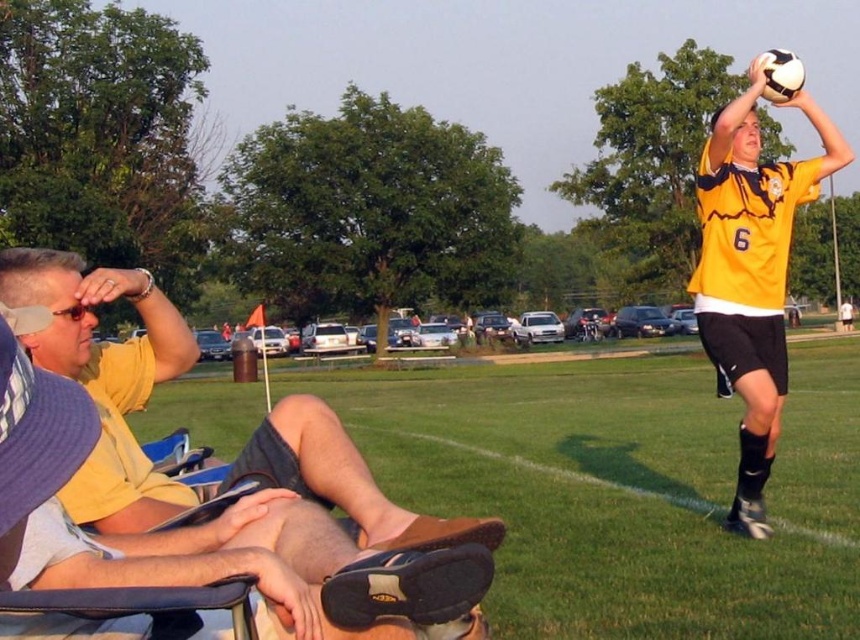
Question: Is yellow cotton shirt at left in front of yellow jersey at upper right?

Choices:
 (A) no
 (B) yes

Answer: (B)

Question: Observing the image, what is the correct spatial positioning of matte yellow sunglasses at upper left in reference to yellow jersey at upper right?

Choices:
 (A) above
 (B) below

Answer: (B)

Question: Among these points, which one is farthest from the camera?

Choices:
 (A) (13, 468)
 (B) (17, 285)

Answer: (B)

Question: Which is nearer to the dark blue fabric folding chair at lower left?

Choices:
 (A) yellow jersey at upper right
 (B) yellow cotton shirt at left
 (C) matte yellow sunglasses at upper left

Answer: (B)

Question: Which point is farther from the camera taking this photo?

Choices:
 (A) (717, 166)
 (B) (71, 353)
 (C) (11, 259)

Answer: (A)

Question: Does dark blue fabric folding chair at lower left appear under yellow jersey at upper right?

Choices:
 (A) yes
 (B) no

Answer: (A)